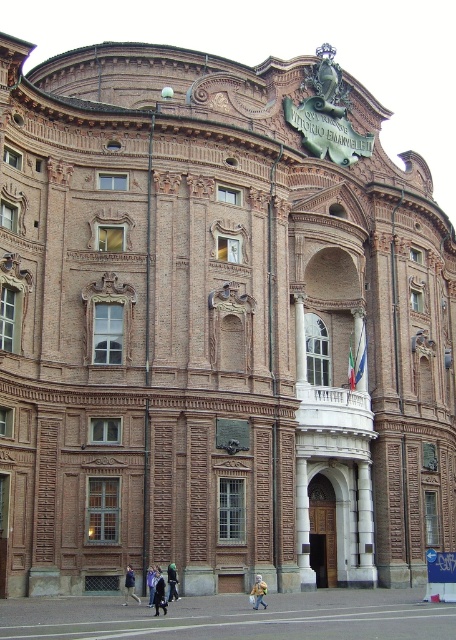
You are a delivery person standing at the entrance of the grand building. You need to hand over a package to a person wearing dark blue jacket at lower center and dark blue jeans at lower center. Can you reach them without moving closer than 1.8 meters from their current position?

The dark blue jacket at lower center is 1.84 meters away from dark blue jeans at lower center. Since the required distance is 1.8 meters, you can reach them without moving closer than 1.8 meters because the distance between them is slightly more than the required minimum distance.

You are standing in front of the grand building and notice two points marked on its facade. The first point is at coordinate point(160,572) and the second is at point(263,588). From your perspective, which point is closer to you?

Point(263,588) is closer to you because it is in front of point(160,572) according to their coordinates.

You are standing in front of the grand building and want to reach the point at coordinates point (156,600). Given that the shortest path to it is 135.98 feet, can you estimate whether you can reach it within 30 seconds if you walk at a normal pace?

The point (156,600) is 135.98 feet away from the camera. Walking at a normal pace of about 3 feet per second, it would take approximately 45.3 seconds to reach it, so you cannot reach it within 30 seconds.